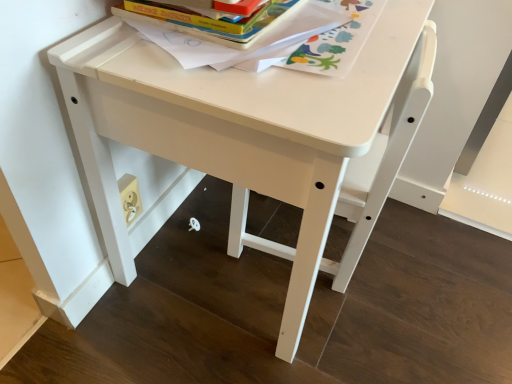
Question: Looking at their shapes, would you say white plastic chair at center is wider or thinner than white matte table at center?

Choices:
 (A) thin
 (B) wide

Answer: (A)

Question: Considering the positions of point (425, 61) and point (326, 115), is point (425, 61) closer or farther from the camera than point (326, 115)?

Choices:
 (A) farther
 (B) closer

Answer: (A)

Question: Based on their relative distances, which object is nearer to the white matte table at center?

Choices:
 (A) hardcover book at upper center
 (B) white plastic chair at center
 (C) hardcover book at upper center

Answer: (B)

Question: Which object is positioned farthest from the hardcover book at upper center?

Choices:
 (A) white plastic chair at center
 (B) white matte table at center
 (C) hardcover book at upper center

Answer: (A)